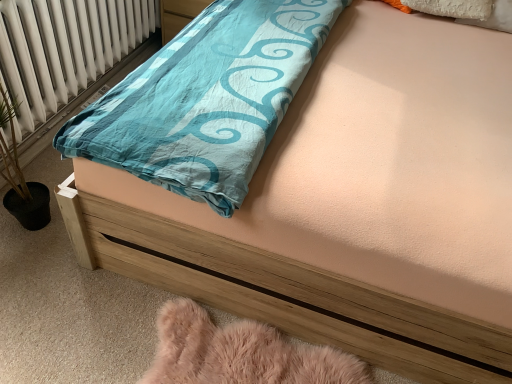
The height and width of the screenshot is (384, 512). I want to click on free space above fuzzy pink rug at lower left (from a real-world perspective), so click(247, 360).